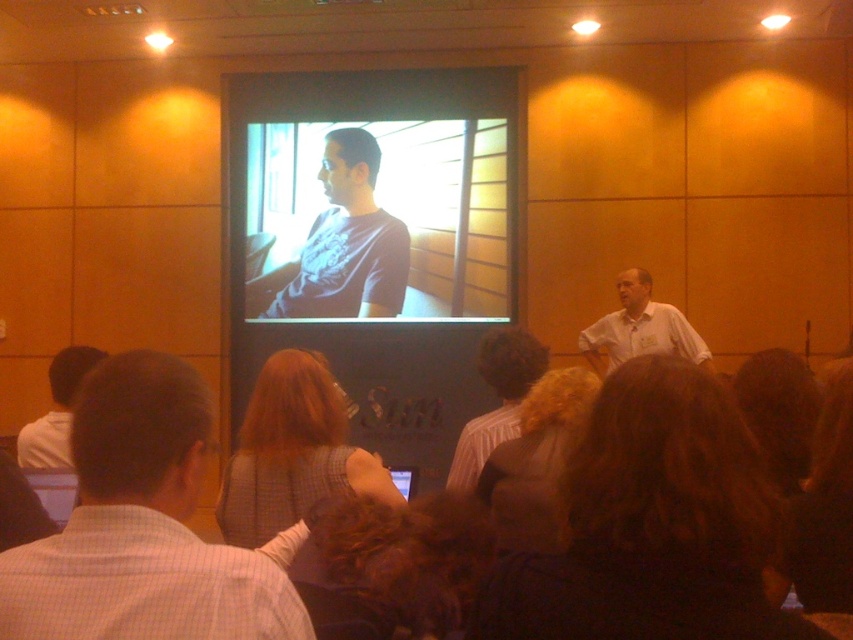
How much distance is there between white checkered shirt at lower left and fuzzy brown hair at center?

white checkered shirt at lower left is 4.50 feet from fuzzy brown hair at center.

Who is positioned more to the right, white checkered shirt at lower left or fuzzy brown hair at center?

From the viewer's perspective, fuzzy brown hair at center appears more on the right side.

Which is in front, point (155, 552) or point (560, 392)?

Point (155, 552) is in front.

Where is `white checkered shirt at lower left`? The width and height of the screenshot is (853, 640). white checkered shirt at lower left is located at coordinates [x=142, y=525].

Is white checkered shirt at lower left positioned at the back of purple matte shirt at upper center?

That is False.

Can you confirm if white checkered shirt at lower left is positioned below purple matte shirt at upper center?

Yes.

Between point (167, 529) and point (347, 157), which one is positioned behind?

The point (347, 157) is behind.

What are the coordinates of `white checkered shirt at lower left` in the screenshot? It's located at (142, 525).

Does point (675, 528) lie behind point (527, 458)?

No, (675, 528) is closer to viewer.

Does dark brown hair at lower center appear over fuzzy brown hair at center?

No.

Which is in front, point (723, 582) or point (531, 468)?

Point (723, 582)

At what (x,y) coordinates should I click in order to perform the action: click on dark brown hair at lower center. Please return your answer as a coordinate pair (x, y). Looking at the image, I should click on (653, 524).